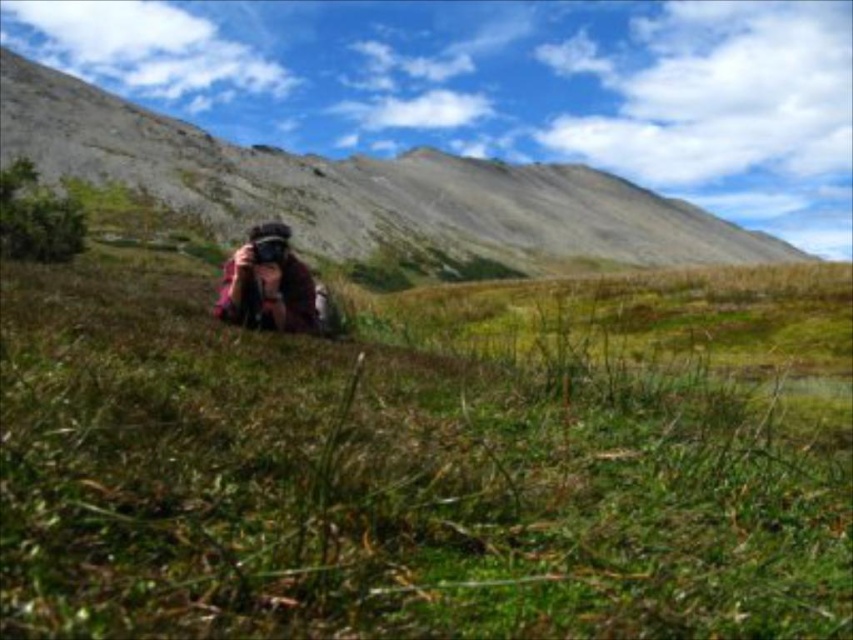
Find the location of a particular element. This screenshot has width=853, height=640. smooth gray rock at center is located at coordinates (363, 188).

Between point (252, 168) and point (228, 284), which one is positioned in front?

Positioned in front is point (228, 284).

Locate an element on the screen. smooth gray rock at center is located at coordinates (363, 188).